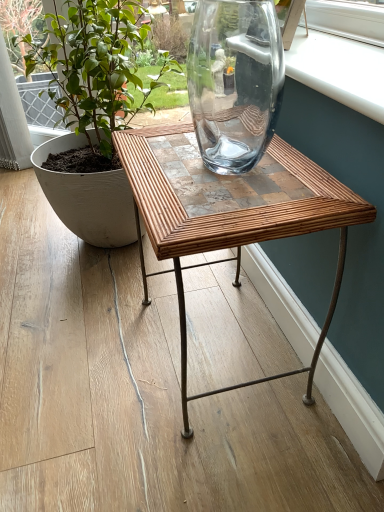
The image size is (384, 512). Describe the element at coordinates (94, 110) in the screenshot. I see `green matte plant at left` at that location.

What are the coordinates of `green matte plant at left` in the screenshot? It's located at (94, 110).

Find the location of a particular element. Image resolution: width=384 pixels, height=512 pixels. bamboowoodentable at center is located at coordinates (234, 224).

In order to face bamboowoodentable at center, should I rotate leftwards or rightwards?

To align with it, rotate right about 3.755°.

Image resolution: width=384 pixels, height=512 pixels. What do you see at coordinates (234, 224) in the screenshot?
I see `bamboowoodentable at center` at bounding box center [234, 224].

Where is `green matte plant at left`? The height and width of the screenshot is (512, 384). green matte plant at left is located at coordinates (94, 110).

Which is more to the left, green matte plant at left or bamboowoodentable at center?

From the viewer's perspective, green matte plant at left appears more on the left side.

Considering their positions, is green matte plant at left located in front of or behind bamboowoodentable at center?

green matte plant at left is positioned farther from the viewer than bamboowoodentable at center.

Is point (93, 64) positioned before point (144, 170)?

No, it is behind (144, 170).

From the image's perspective, which is above, green matte plant at left or bamboowoodentable at center?

green matte plant at left is shown above in the image.

From a real-world perspective, is green matte plant at left positioned over bamboowoodentable at center based on gravity?

Yes, from a real-world perspective, green matte plant at left is on top of bamboowoodentable at center.

Does green matte plant at left have a greater width compared to bamboowoodentable at center?

Yes.

Is green matte plant at left taller than bamboowoodentable at center?

Indeed, green matte plant at left has a greater height compared to bamboowoodentable at center.

Considering the relative sizes of green matte plant at left and bamboowoodentable at center in the image provided, is green matte plant at left bigger than bamboowoodentable at center?

Yes.

From the picture: Would you say green matte plant at left is outside bamboowoodentable at center?

Indeed, green matte plant at left is completely outside bamboowoodentable at center.

Is green matte plant at left next to bamboowoodentable at center and touching it?

green matte plant at left and bamboowoodentable at center are clearly separated.

Is green matte plant at left facing towards bamboowoodentable at center?

No, green matte plant at left does not turn towards bamboowoodentable at center.

This screenshot has width=384, height=512. Find the location of `table in front of the green matte plant at left`. table in front of the green matte plant at left is located at coordinates (234, 224).

Is bamboowoodentable at center at the right side of green matte plant at left?

Yes, bamboowoodentable at center is to the right of green matte plant at left.

Considering their positions, is bamboowoodentable at center located in front of or behind green matte plant at left?

bamboowoodentable at center is positioned closer to the viewer than green matte plant at left.

Is point (185, 343) farther from camera compared to point (106, 71)?

No, (185, 343) is in front of (106, 71).

Consider the image. From the image's perspective, who appears lower, bamboowoodentable at center or green matte plant at left?

bamboowoodentable at center appears lower in the image.

From a real-world perspective, which object stands above the other?

In real-world perspective, green matte plant at left is above.

Considering the relative sizes of bamboowoodentable at center and green matte plant at left in the image provided, is bamboowoodentable at center thinner than green matte plant at left?

Yes.

Is bamboowoodentable at center taller than green matte plant at left?

Incorrect, the height of bamboowoodentable at center is not larger of that of green matte plant at left.

Which of these two, bamboowoodentable at center or green matte plant at left, is bigger?

Bigger between the two is green matte plant at left.

Consider the image. Is bamboowoodentable at center located outside green matte plant at left?

bamboowoodentable at center lies outside green matte plant at left's area.

Are bamboowoodentable at center and green matte plant at left making contact?

No, bamboowoodentable at center is not making contact with green matte plant at left.

Consider the image. Is bamboowoodentable at center aimed at green matte plant at left?

No, bamboowoodentable at center does not turn towards green matte plant at left.

How many degrees apart are the facing directions of bamboowoodentable at center and green matte plant at left?

The angular difference between bamboowoodentable at center and green matte plant at left is 50 degrees.

How distant is bamboowoodentable at center from green matte plant at left?

The distance of bamboowoodentable at center from green matte plant at left is 18.19 inches.

Image resolution: width=384 pixels, height=512 pixels. Identify the location of houseplant that is on the left side of bamboowoodentable at center. (94, 110).

Where is `table in front of the green matte plant at left`? The width and height of the screenshot is (384, 512). table in front of the green matte plant at left is located at coordinates (234, 224).

I want to click on table located below the green matte plant at left (from the image's perspective), so click(x=234, y=224).